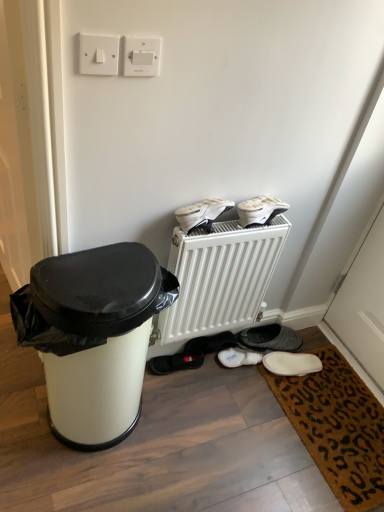
You are a GUI agent. You are given a task and a screenshot of the screen. Output one action in this format:
    pyautogui.click(x=<x>, y=<y>)
    Task: Click on the free location to the right of white matte plastic trash can at left
    Image resolution: width=384 pixels, height=512 pixels.
    Given the screenshot: What is the action you would take?
    pyautogui.click(x=203, y=437)